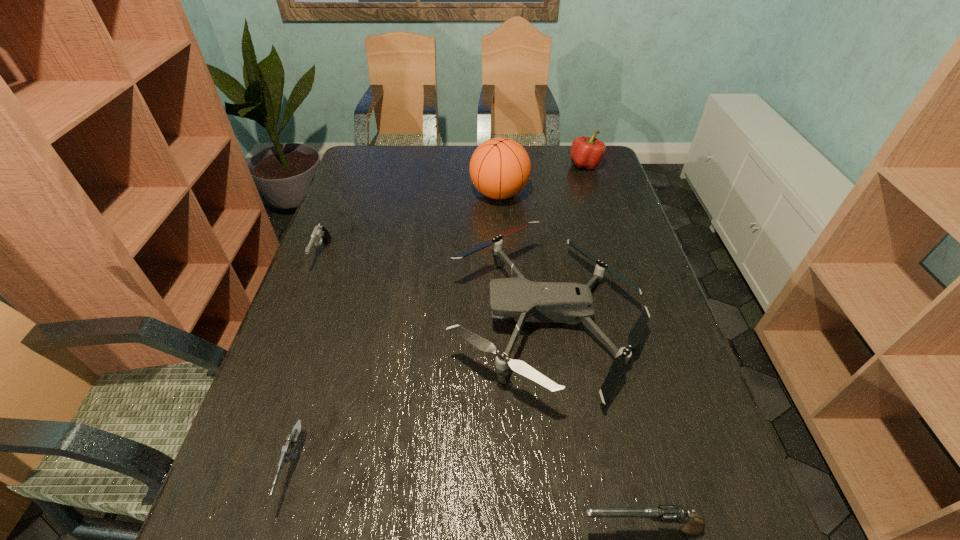
Where is `bell pepper that is at the far edge`? This screenshot has width=960, height=540. bell pepper that is at the far edge is located at coordinates (587, 152).

The image size is (960, 540). Find the location of `object that is positioned at the near edge`. object that is positioned at the near edge is located at coordinates (691, 524).

Find the location of a particular element. The image size is (960, 540). bell pepper at the right edge is located at coordinates (587, 152).

Locate an element on the screen. This screenshot has height=540, width=960. drone that is at the right edge is located at coordinates (527, 301).

Find the location of a particular element. gun that is at the right edge is located at coordinates (691, 524).

Where is `object present at the far right corner`? object present at the far right corner is located at coordinates (587, 152).

Find the location of `object present at the near right corner`. object present at the near right corner is located at coordinates (691, 524).

The width and height of the screenshot is (960, 540). What are the coordinates of `vacant area at the left edge` in the screenshot? It's located at click(x=377, y=210).

You are a GUI agent. You are given a task and a screenshot of the screen. Output one action in this format:
    pyautogui.click(x=<x>, y=<y>)
    Task: Click on the vacant space at the right edge of the desktop
    This screenshot has height=540, width=960.
    Given the screenshot: What is the action you would take?
    pyautogui.click(x=644, y=268)

Locate an element on the screen. vacant space at the far left corner of the desktop is located at coordinates (351, 166).